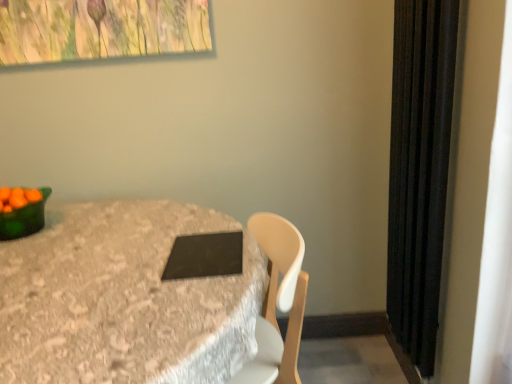
The image size is (512, 384). I want to click on vacant area that lies to the right of green glossy bowl at left, so 88,222.